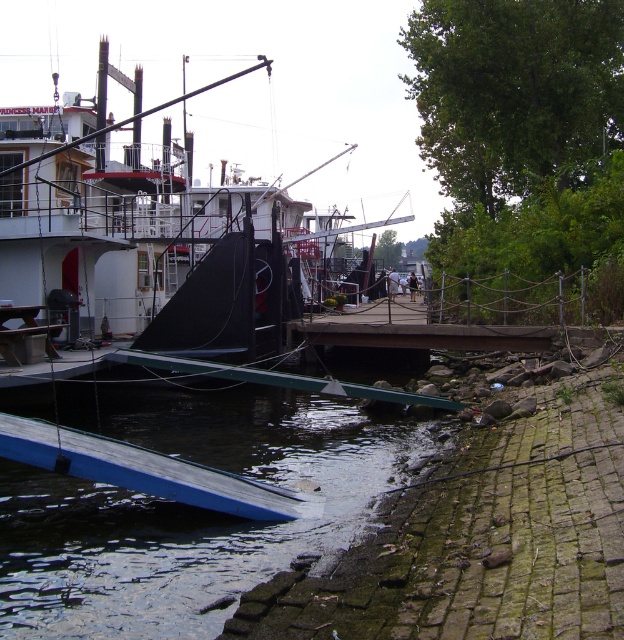
This screenshot has height=640, width=624. In order to click on blue rubber ramp at lower left in this screenshot , I will do `click(173, 509)`.

Can you confirm if blue rubber ramp at lower left is bigger than green mossy bricks at lower right?

Correct, blue rubber ramp at lower left is larger in size than green mossy bricks at lower right.

Is point (185, 424) closer to camera compared to point (578, 465)?

That is False.

Image resolution: width=624 pixels, height=640 pixels. I want to click on blue rubber ramp at lower left, so click(173, 509).

Consider the image. Is green mossy bricks at lower right above white glossy boat at center?

No, green mossy bricks at lower right is not above white glossy boat at center.

Which is in front, point (595, 611) or point (97, 156)?

Point (595, 611) is in front.

Between point (452, 602) and point (41, 156), which one is positioned behind?

Positioned behind is point (41, 156).

Find the location of `green mossy bricks at lower right`. green mossy bricks at lower right is located at coordinates (480, 538).

Which is above, blue rubber ramp at lower left or white glossy boat at center?

white glossy boat at center

Who is shorter, blue rubber ramp at lower left or white glossy boat at center?

With less height is blue rubber ramp at lower left.

Which is behind, point (182, 532) or point (305, 176)?

Point (305, 176)

Image resolution: width=624 pixels, height=640 pixels. I want to click on blue rubber ramp at lower left, so click(173, 509).